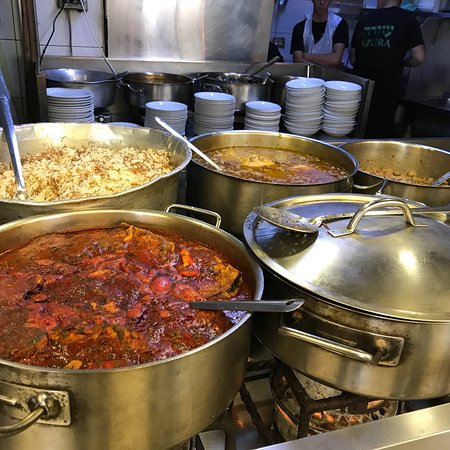
Image resolution: width=450 pixels, height=450 pixels. What are the coordinates of `stove burner` in the screenshot? It's located at (323, 417).